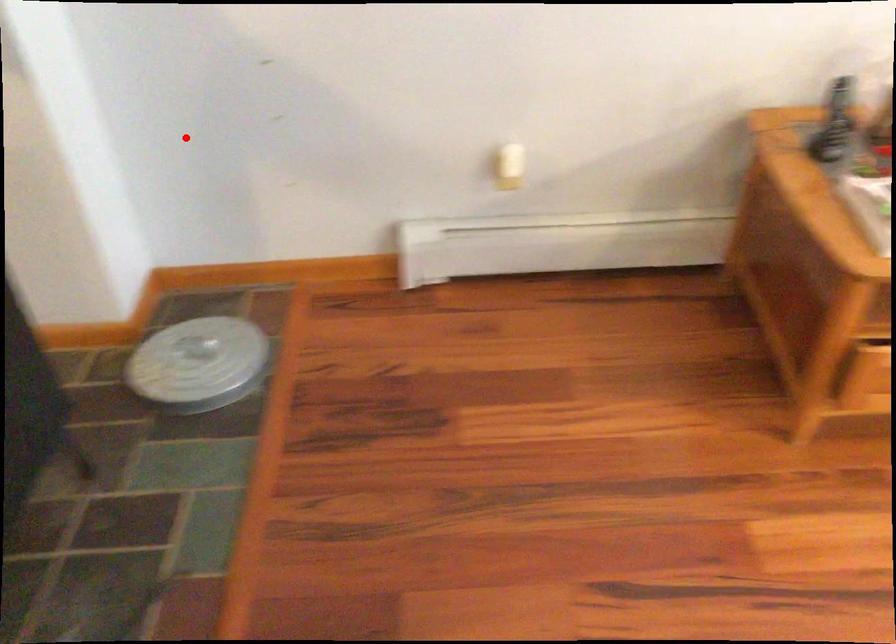
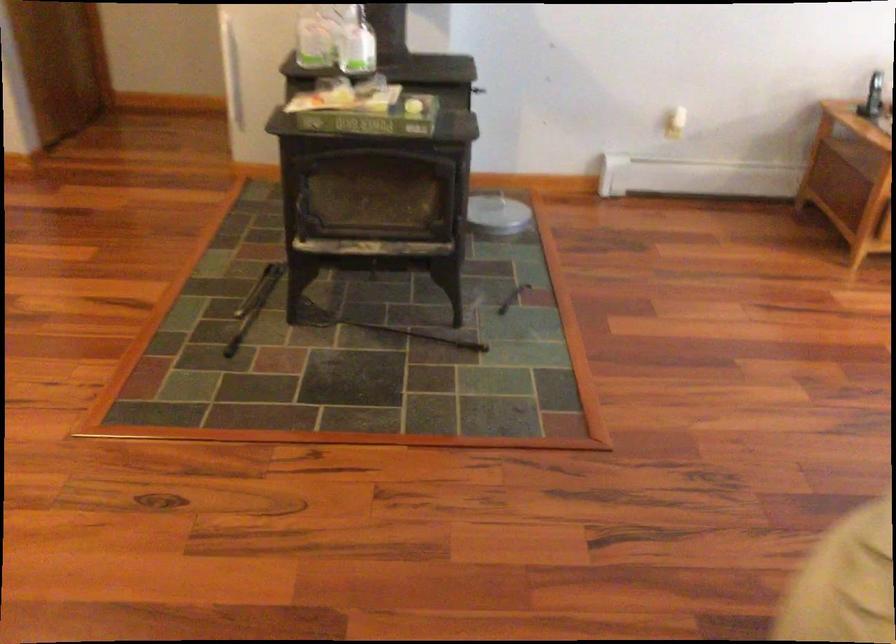
Find the pixel in the second image that matches the highlighted location in the first image.

(477, 90)